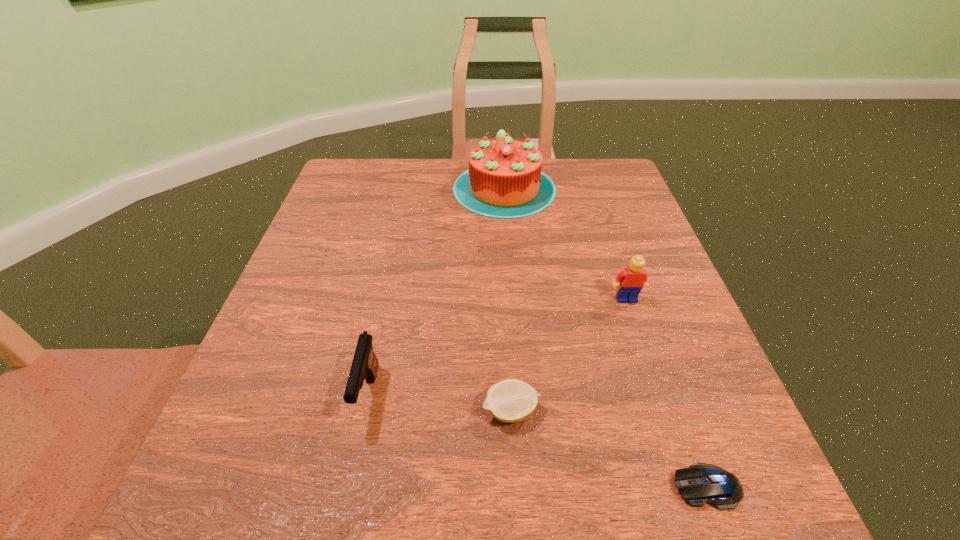
Identify the location of empty location between the leftmost object and the computer mouse. This screenshot has height=540, width=960. (538, 441).

This screenshot has height=540, width=960. Find the location of `empty space that is in between the lemon and the computer mouse`. empty space that is in between the lemon and the computer mouse is located at coordinates (609, 449).

At what (x,y) coordinates should I click in order to perform the action: click on free space between the lemon and the nearest object. Please return your answer as a coordinate pair (x, y). Image resolution: width=960 pixels, height=540 pixels. Looking at the image, I should click on (609, 449).

Identify the location of blank region between the Lego and the shortest object. (666, 393).

Where is `vacant point located between the fourth tallest object and the second farthest object`? vacant point located between the fourth tallest object and the second farthest object is located at coordinates (568, 355).

You are a GUI agent. You are given a task and a screenshot of the screen. Output one action in this format:
    pyautogui.click(x=<x>, y=<y>)
    Task: Click on the fourth closest object to the cake
    This screenshot has width=960, height=540.
    Given the screenshot: What is the action you would take?
    pyautogui.click(x=700, y=483)

Locate which object is the closest to the second farthest object. Please provide its 2D coordinates. Your answer should be formatted as a tuple, i.e. [(x, y)], where the tuple contains the x and y coordinates of a point satisfying the conditions above.

[(511, 400)]

Image resolution: width=960 pixels, height=540 pixels. I want to click on free space that satisfies the following two spatial constraints: 1. at the barrel of the lemon; 2. on the left side of the pistol, so click(x=365, y=411).

You are a GUI agent. You are given a task and a screenshot of the screen. Output one action in this format:
    pyautogui.click(x=<x>, y=<y>)
    Task: Click on the free space that satisfies the following two spatial constraints: 1. on the back side of the fourth tallest object; 2. on the left side of the cake
    Image resolution: width=960 pixels, height=540 pixels.
    Given the screenshot: What is the action you would take?
    pyautogui.click(x=498, y=188)